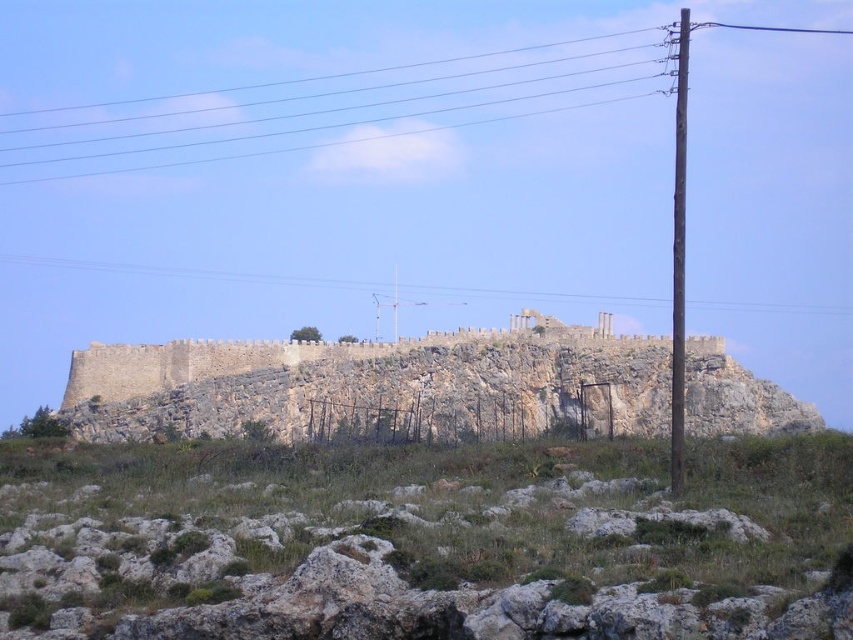
You are a hiker trying to navigate through the rugged landscape. You notice the rocky terrain at center and the metallic wires at upper center. Which of these two features is bigger in size?

The rocky terrain at center is larger in size compared to the metallic wires at upper center.

You are a painter planning to sketch the rustic stone wall at center and the metallic wire at upper center. Which object should you focus on first if you want to capture the larger subject in your painting?

The rustic stone wall at center is bigger than the metallic wire at upper center, so you should focus on the rustic stone wall at center first to capture its larger size in your painting.

You are an architect examining the ancient stone structure. You notice the rustic stone wall at center and the metallic wire at upper center. Which object is narrower in width?

The rustic stone wall at center has a lesser width compared to the metallic wire at upper center, so the rustic stone wall at center is narrower.